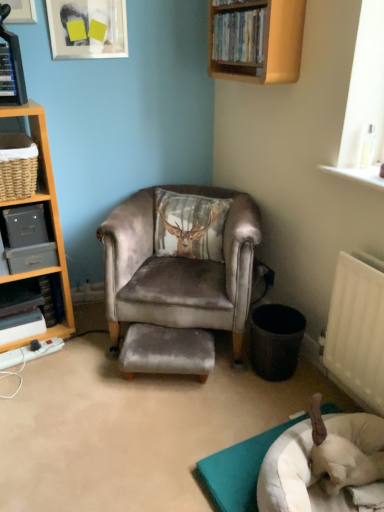
Locate an element on the screen. The height and width of the screenshot is (512, 384). free space to the left of black plastic trash can at lower right is located at coordinates (232, 373).